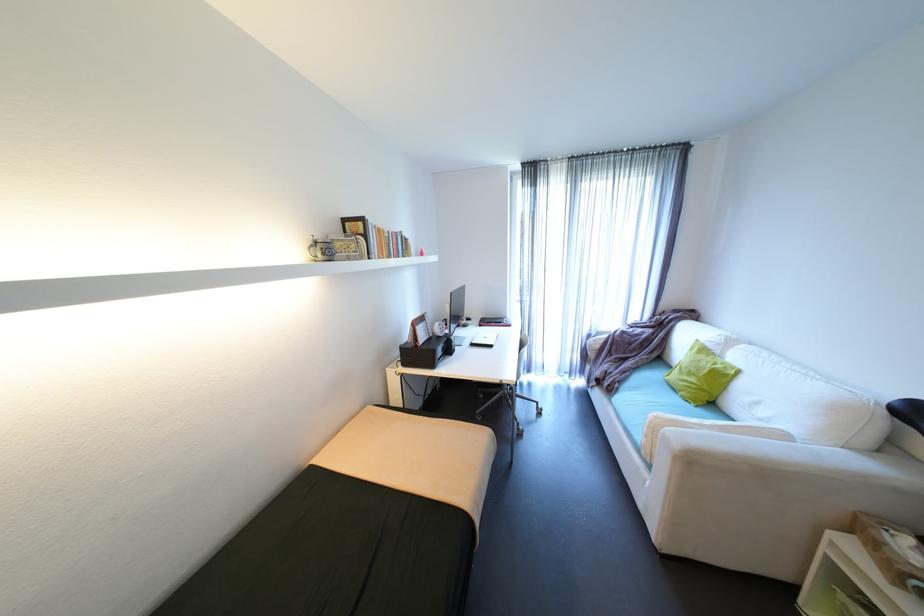
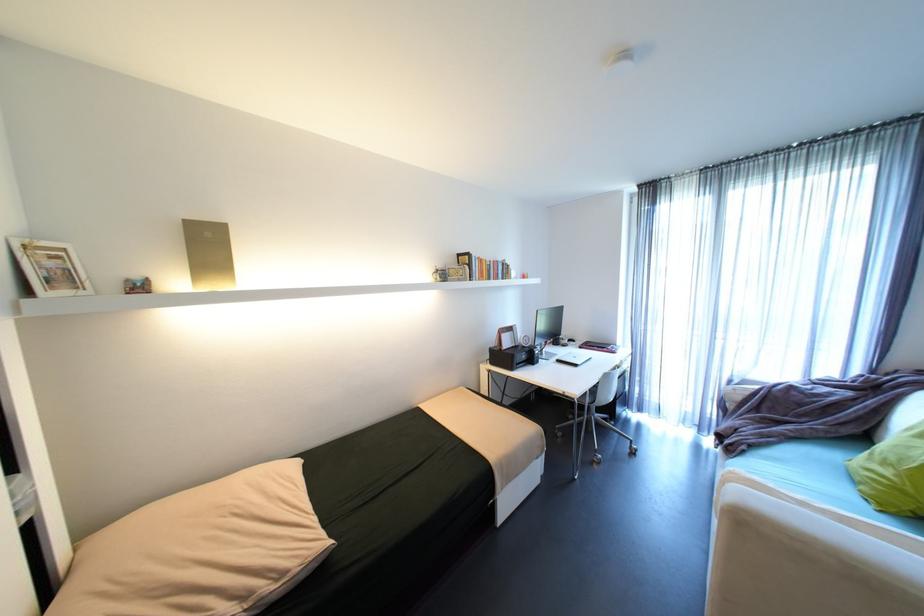
The point at [320,236] is marked in the first image. Where is the corresponding point in the second image?

(444, 267)